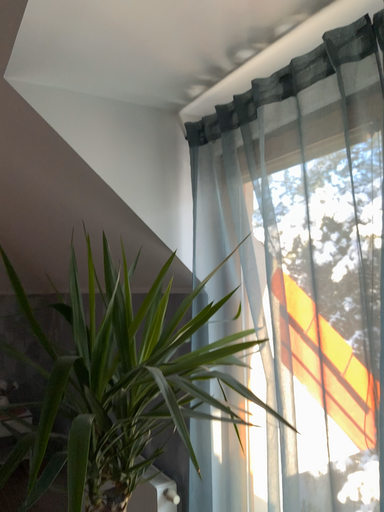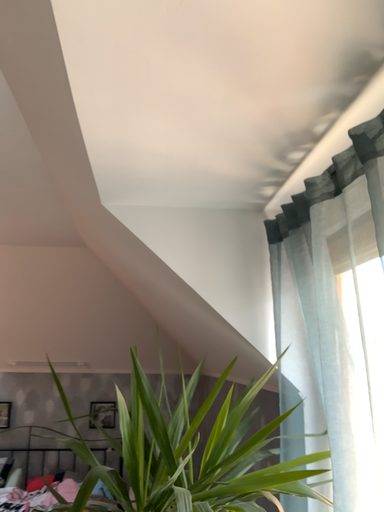
Question: How did the camera likely rotate when shooting the video?

Choices:
 (A) rotated right
 (B) rotated left

Answer: (B)